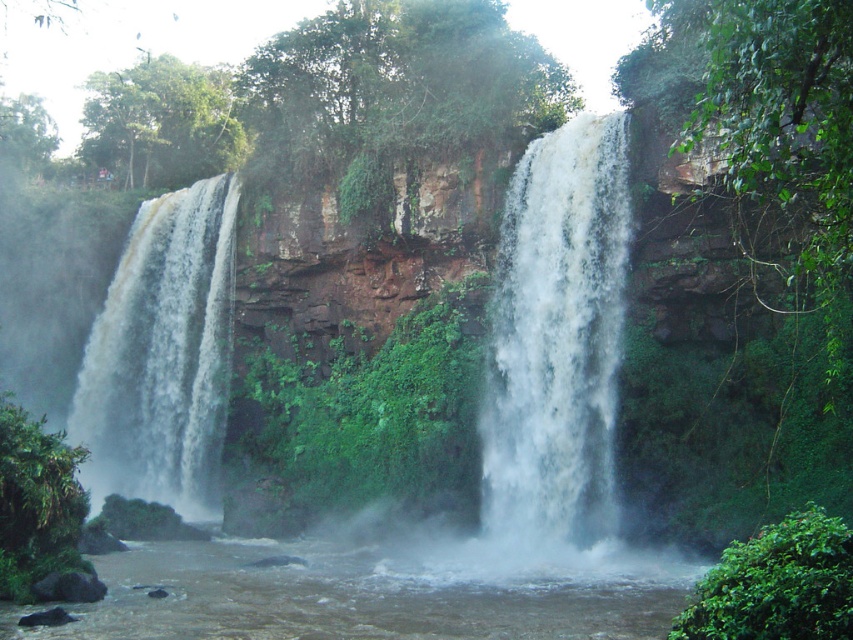
You are a hiker who wants to cross the river at the base of the waterfall. You notice two sections of water to choose from. One is the brown muddy water at lower center and the other is the white frothy water at center. Based on their widths, which section would be wider and safer to cross?

The brown muddy water at lower center is wider than the white frothy water at center, so it would be the safer option for crossing.

You are standing at the base of the waterfall and notice a point marked at coordinates (375, 592). Based on the scene description, what is the nature of the area at this point?

The point at (375, 592) indicates brown muddy water at lower center.

You are a hiker who wants to cross the waterfall area. You need to step on the brown muddy water at lower center and the white frothy water at left. Which one should you step on first to reach the other side?

You should step on the white frothy water at left first because the brown muddy water at lower center is positioned on its right side, meaning the white frothy water at left is closer to you.